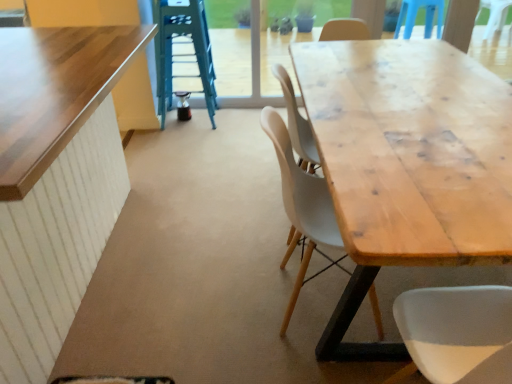
Question: Considering the relative sizes of green metallic ladder at upper center and natural wood table at center, the 2th table when ordered from left to right, in the image provided, is green metallic ladder at upper center wider than natural wood table at center, the 2th table when ordered from left to right,?

Choices:
 (A) yes
 (B) no

Answer: (B)

Question: From a real-world perspective, does green metallic ladder at upper center sit lower than natural wood table at center, the 2th table when ordered from left to right?

Choices:
 (A) yes
 (B) no

Answer: (B)

Question: Would you consider green metallic ladder at upper center to be distant from natural wood table at center, positioned as the first table in right-to-left order?

Choices:
 (A) no
 (B) yes

Answer: (B)

Question: Is green metallic ladder at upper center smaller than natural wood table at center, positioned as the first table in right-to-left order?

Choices:
 (A) no
 (B) yes

Answer: (B)

Question: Can we say green metallic ladder at upper center lies outside natural wood table at center, the 2th table when ordered from left to right?

Choices:
 (A) yes
 (B) no

Answer: (A)

Question: In the image, is matte wood chair at center on the left side or the right side of natural wood table at center, the 2th table when ordered from left to right?

Choices:
 (A) left
 (B) right

Answer: (A)

Question: Looking at the image, does matte wood chair at center seem bigger or smaller compared to natural wood table at center, positioned as the first table in right-to-left order?

Choices:
 (A) small
 (B) big

Answer: (A)

Question: Is matte wood chair at center taller or shorter than natural wood table at center, positioned as the first table in right-to-left order?

Choices:
 (A) short
 (B) tall

Answer: (B)

Question: Considering the positions of point (333, 263) and point (386, 347), is point (333, 263) closer or farther from the camera than point (386, 347)?

Choices:
 (A) farther
 (B) closer

Answer: (A)

Question: Considering the positions of wooden table at left, marked as the second table in a right-to-left arrangement, and green metallic ladder at upper center in the image, is wooden table at left, marked as the second table in a right-to-left arrangement, wider or thinner than green metallic ladder at upper center?

Choices:
 (A) thin
 (B) wide

Answer: (B)

Question: From the image's perspective, is wooden table at left, the 1th table viewed from the left, above or below green metallic ladder at upper center?

Choices:
 (A) above
 (B) below

Answer: (B)

Question: Considering the positions of wooden table at left, marked as the second table in a right-to-left arrangement, and green metallic ladder at upper center in the image, is wooden table at left, marked as the second table in a right-to-left arrangement, taller or shorter than green metallic ladder at upper center?

Choices:
 (A) short
 (B) tall

Answer: (A)

Question: From a real-world perspective, is wooden table at left, the 1th table viewed from the left, positioned above or below green metallic ladder at upper center?

Choices:
 (A) below
 (B) above

Answer: (A)

Question: In terms of width, does natural wood table at center, the 2th table when ordered from left to right, look wider or thinner when compared to green metallic ladder at upper center?

Choices:
 (A) thin
 (B) wide

Answer: (B)

Question: Considering the positions of natural wood table at center, the 2th table when ordered from left to right, and green metallic ladder at upper center in the image, is natural wood table at center, the 2th table when ordered from left to right, taller or shorter than green metallic ladder at upper center?

Choices:
 (A) tall
 (B) short

Answer: (B)